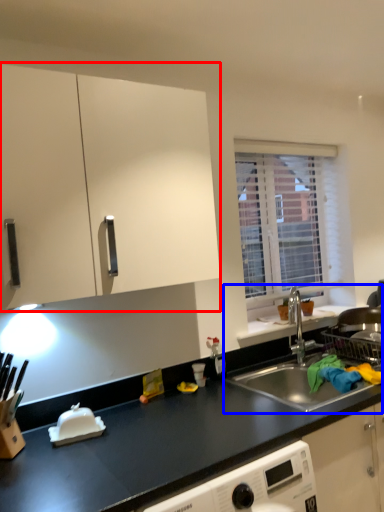
Question: Which object is further to the camera taking this photo, cabinetry (highlighted by a red box) or sink (highlighted by a blue box)?

Choices:
 (A) cabinetry
 (B) sink

Answer: (B)